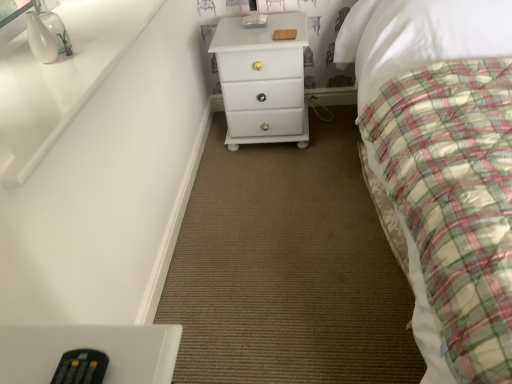
Question: From the image's perspective, is black plastic remote at lower left positioned above or below plaid fabric bed at right?

Choices:
 (A) below
 (B) above

Answer: (A)

Question: Considering the positions of black plastic remote at lower left and plaid fabric bed at right in the image, is black plastic remote at lower left taller or shorter than plaid fabric bed at right?

Choices:
 (A) tall
 (B) short

Answer: (B)

Question: Which of these objects is positioned farthest from the black plastic remote at lower left?

Choices:
 (A) plaid fabric bed at right
 (B) white glossy chest of drawers at center

Answer: (B)

Question: Which is nearer to the black plastic remote at lower left?

Choices:
 (A) plaid fabric bed at right
 (B) white glossy chest of drawers at center

Answer: (A)